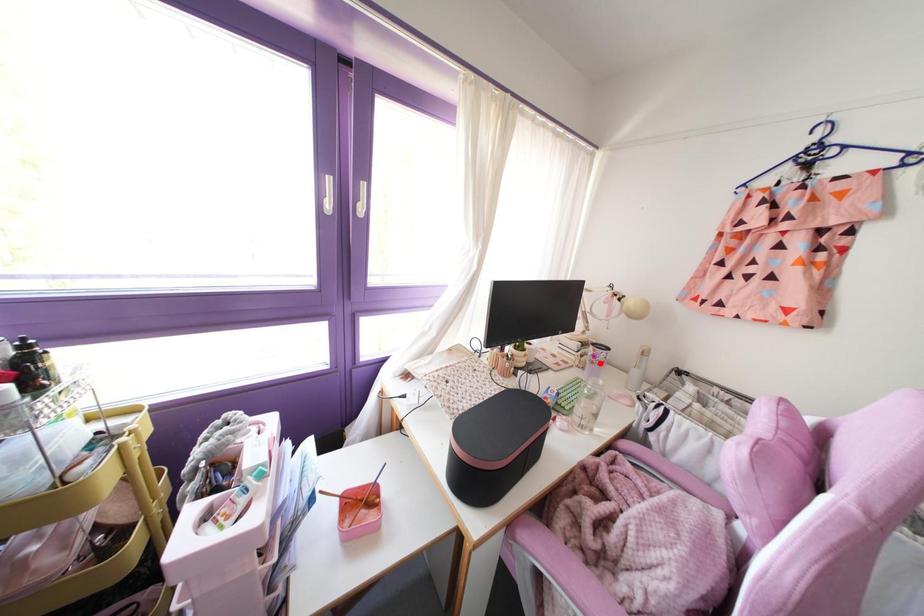
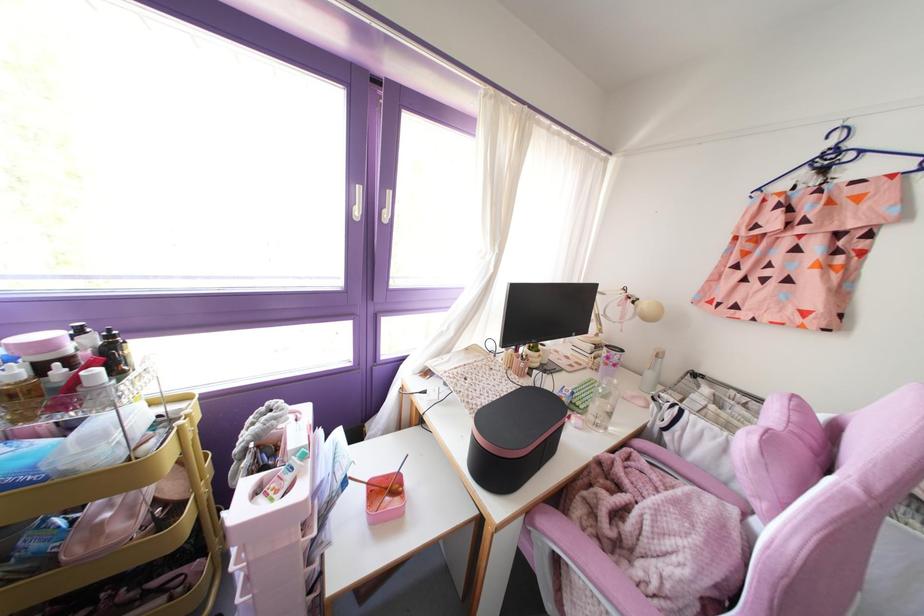
The point at the highlighted location is marked in the first image. Where is the corresponding point in the second image?

(614, 365)